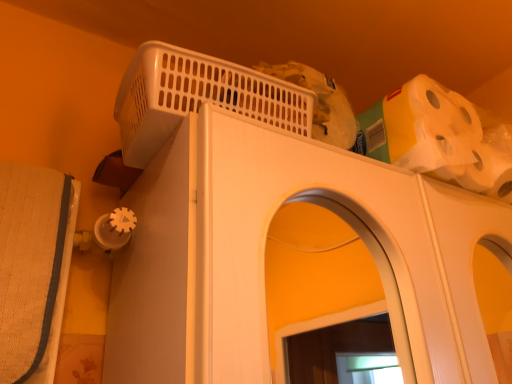
Question: Is white matte toilet paper at upper right wider or thinner than white plastic basket at upper center?

Choices:
 (A) wide
 (B) thin

Answer: (B)

Question: Based on their sizes in the image, would you say white matte toilet paper at upper right is bigger or smaller than white plastic basket at upper center?

Choices:
 (A) small
 (B) big

Answer: (B)

Question: Estimate the real-world distances between objects in this image. Which object is farther from the white plastic basket at upper center?

Choices:
 (A) white plastic basket at upper center
 (B) white matte toilet paper at upper right

Answer: (B)

Question: Which of these objects is positioned closest to the white plastic basket at upper center?

Choices:
 (A) white plastic basket at upper center
 (B) white matte toilet paper at upper right

Answer: (A)